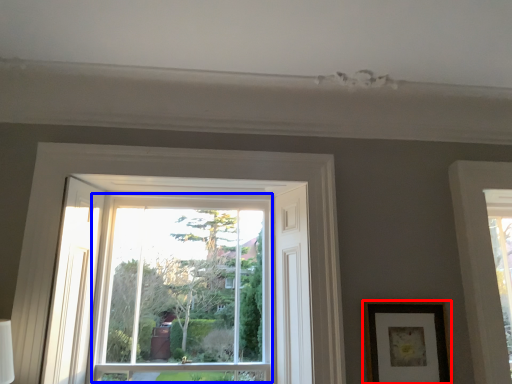
Question: Which point is closer to the camera, picture frame (highlighted by a red box) or bay window (highlighted by a blue box)?

Choices:
 (A) picture frame
 (B) bay window

Answer: (A)